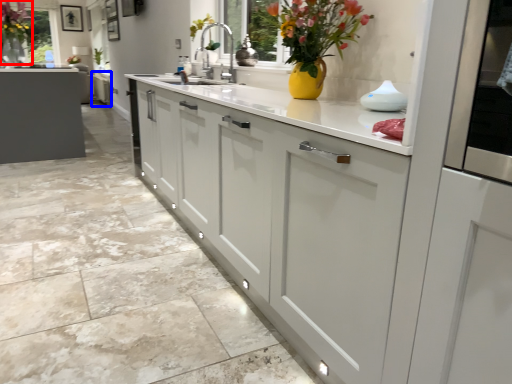
Question: Which object is further to the camera taking this photo, floral arrangement (highlighted by a red box) or cabinetry (highlighted by a blue box)?

Choices:
 (A) floral arrangement
 (B) cabinetry

Answer: (B)